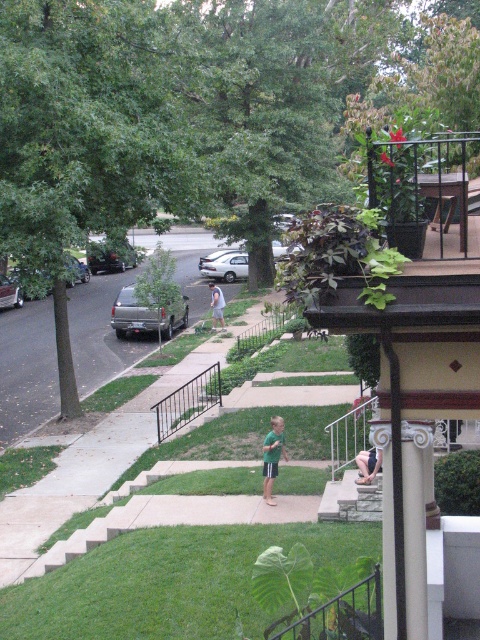
Question: Which point appears farthest from the camera in this image?

Choices:
 (A) (163, 326)
 (B) (99, 346)

Answer: (A)

Question: Does silver metallic truck at left come behind silver metallic sedan at left?

Choices:
 (A) yes
 (B) no

Answer: (A)

Question: Can you confirm if concrete stairs at lower right is smaller than green fabric shorts at center?

Choices:
 (A) yes
 (B) no

Answer: (B)

Question: Based on their relative distances, which object is nearer to the green fabric shirt at center?

Choices:
 (A) shiny silver suv at left
 (B) green grass at lower center

Answer: (B)

Question: Can you confirm if shiny silver suv at left is wider than green fabric shorts at center?

Choices:
 (A) yes
 (B) no

Answer: (A)

Question: Which point appears closest to the camera in this image?

Choices:
 (A) (365, 630)
 (B) (49, 316)
 (C) (226, 262)

Answer: (A)